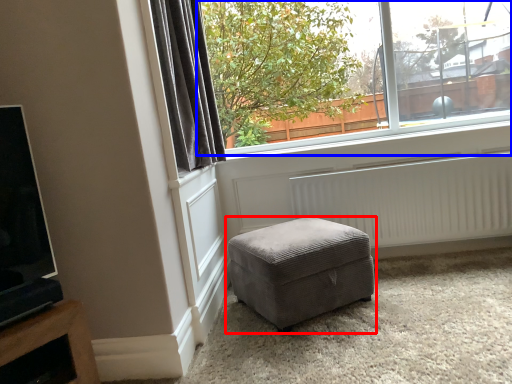
Question: Which object appears closest to the camera in this image, studio couch (highlighted by a red box) or window (highlighted by a blue box)?

Choices:
 (A) studio couch
 (B) window

Answer: (A)